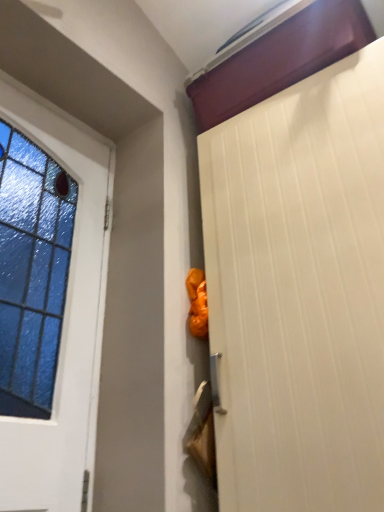
The width and height of the screenshot is (384, 512). What do you see at coordinates (299, 292) in the screenshot? I see `white textured door at upper right, the 2th door positioned from the left` at bounding box center [299, 292].

You are a GUI agent. You are given a task and a screenshot of the screen. Output one action in this format:
    pyautogui.click(x=<x>, y=<y>)
    Task: Click on the white textured door at upper right, the 2th door positioned from the left
    Image resolution: width=384 pixels, height=512 pixels.
    Given the screenshot: What is the action you would take?
    pyautogui.click(x=299, y=292)

What do you see at coordinates (63, 320) in the screenshot? I see `white glass door at left, the first door in the left-to-right sequence` at bounding box center [63, 320].

Image resolution: width=384 pixels, height=512 pixels. Find the location of `white glass door at left, marked as the 2th door in a right-to-left arrangement`. white glass door at left, marked as the 2th door in a right-to-left arrangement is located at coordinates (63, 320).

Where is `white textured door at upper right, the 2th door positioned from the left`? white textured door at upper right, the 2th door positioned from the left is located at coordinates (299, 292).

Which is more to the right, white glass door at left, marked as the 2th door in a right-to-left arrangement, or white textured door at upper right, the 1th door positioned from the right?

From the viewer's perspective, white textured door at upper right, the 1th door positioned from the right, appears more on the right side.

Between white glass door at left, the first door in the left-to-right sequence, and white textured door at upper right, the 1th door positioned from the right, which one is positioned behind?

white glass door at left, the first door in the left-to-right sequence, is behind.

Does point (20, 440) come in front of point (377, 162)?

Yes, it is in front of point (377, 162).

From the image's perspective, between white glass door at left, the first door in the left-to-right sequence, and white textured door at upper right, the 1th door positioned from the right, which one is located above?

From the image's view, white glass door at left, the first door in the left-to-right sequence, is above.

From a real-world perspective, who is located higher, white glass door at left, the first door in the left-to-right sequence, or white textured door at upper right, the 2th door positioned from the left?

In real-world perspective, white glass door at left, the first door in the left-to-right sequence, is above.

Can you confirm if white glass door at left, marked as the 2th door in a right-to-left arrangement, is wider than white textured door at upper right, the 2th door positioned from the left?

In fact, white glass door at left, marked as the 2th door in a right-to-left arrangement, might be narrower than white textured door at upper right, the 2th door positioned from the left.

Who is shorter, white glass door at left, marked as the 2th door in a right-to-left arrangement, or white textured door at upper right, the 1th door positioned from the right?

With less height is white glass door at left, marked as the 2th door in a right-to-left arrangement.

Can you confirm if white glass door at left, marked as the 2th door in a right-to-left arrangement, is smaller than white textured door at upper right, the 1th door positioned from the right?

Indeed, white glass door at left, marked as the 2th door in a right-to-left arrangement, has a smaller size compared to white textured door at upper right, the 1th door positioned from the right.

Is white glass door at left, the first door in the left-to-right sequence, inside the boundaries of white textured door at upper right, the 2th door positioned from the left, or outside?

The correct answer is: outside.

Are white glass door at left, the first door in the left-to-right sequence, and white textured door at upper right, the 1th door positioned from the right, far apart?

That's not correct — white glass door at left, the first door in the left-to-right sequence, is a little close to white textured door at upper right, the 1th door positioned from the right.

Looking at this image, could you tell me if white glass door at left, marked as the 2th door in a right-to-left arrangement, is facing white textured door at upper right, the 1th door positioned from the right?

No.

What's the angular difference between white glass door at left, marked as the 2th door in a right-to-left arrangement, and white textured door at upper right, the 1th door positioned from the right,'s facing directions?

They differ by 85.3 degrees in their facing directions.

How distant is white glass door at left, marked as the 2th door in a right-to-left arrangement, from white textured door at upper right, the 1th door positioned from the right?

A distance of 20.55 inches exists between white glass door at left, marked as the 2th door in a right-to-left arrangement, and white textured door at upper right, the 1th door positioned from the right.

Find the location of a particular element. door that is under the white glass door at left, the first door in the left-to-right sequence (from a real-world perspective) is located at coordinates (299, 292).

Is white textured door at upper right, the 1th door positioned from the right, to the left of white glass door at left, marked as the 2th door in a right-to-left arrangement, from the viewer's perspective?

No.

Is the depth of white textured door at upper right, the 2th door positioned from the left, less than that of white glass door at left, the first door in the left-to-right sequence?

Yes, white textured door at upper right, the 2th door positioned from the left, is closer to the camera.

Is point (205, 257) less distant than point (79, 485)?

No, it is behind (79, 485).

From the image's perspective, is white textured door at upper right, the 1th door positioned from the right, positioned above or below white glass door at left, marked as the 2th door in a right-to-left arrangement?

white textured door at upper right, the 1th door positioned from the right, is below white glass door at left, marked as the 2th door in a right-to-left arrangement.

In the scene shown: From a real-world perspective, which object rests below the other?

white textured door at upper right, the 1th door positioned from the right, from a real-world perspective.

Considering the sizes of white textured door at upper right, the 1th door positioned from the right, and white glass door at left, the first door in the left-to-right sequence, in the image, is white textured door at upper right, the 1th door positioned from the right, wider or thinner than white glass door at left, the first door in the left-to-right sequence,?

In the image, white textured door at upper right, the 1th door positioned from the right, appears to be wider than white glass door at left, the first door in the left-to-right sequence.

Between white textured door at upper right, the 2th door positioned from the left, and white glass door at left, the first door in the left-to-right sequence, which one has more height?

white textured door at upper right, the 2th door positioned from the left, is taller.

In the scene shown: Does white textured door at upper right, the 1th door positioned from the right, have a smaller size compared to white glass door at left, marked as the 2th door in a right-to-left arrangement?

Incorrect, white textured door at upper right, the 1th door positioned from the right, is not smaller in size than white glass door at left, marked as the 2th door in a right-to-left arrangement.

Would you say white textured door at upper right, the 1th door positioned from the right, is outside white glass door at left, marked as the 2th door in a right-to-left arrangement?

Yes, white textured door at upper right, the 1th door positioned from the right, is located beyond the bounds of white glass door at left, marked as the 2th door in a right-to-left arrangement.

Based on the photo, does white textured door at upper right, the 2th door positioned from the left, touch white glass door at left, marked as the 2th door in a right-to-left arrangement?

No.

Is white textured door at upper right, the 1th door positioned from the right, oriented away from white glass door at left, the first door in the left-to-right sequence?

white textured door at upper right, the 1th door positioned from the right, does not have its back to white glass door at left, the first door in the left-to-right sequence.

Can you tell me how much white textured door at upper right, the 2th door positioned from the left, and white glass door at left, marked as the 2th door in a right-to-left arrangement, differ in facing direction?

85.3 degrees separate the facing orientations of white textured door at upper right, the 2th door positioned from the left, and white glass door at left, marked as the 2th door in a right-to-left arrangement.

Could you measure the distance between white textured door at upper right, the 1th door positioned from the right, and white glass door at left, marked as the 2th door in a right-to-left arrangement?

white textured door at upper right, the 1th door positioned from the right, is 20.55 inches away from white glass door at left, marked as the 2th door in a right-to-left arrangement.

Locate an element on the screen. The width and height of the screenshot is (384, 512). door beneath the white glass door at left, marked as the 2th door in a right-to-left arrangement (from a real-world perspective) is located at coordinates (299, 292).

This screenshot has width=384, height=512. I want to click on door above the white textured door at upper right, the 2th door positioned from the left (from the image's perspective), so click(x=63, y=320).

Where is `door in front of the white glass door at left, the first door in the left-to-right sequence`? This screenshot has height=512, width=384. door in front of the white glass door at left, the first door in the left-to-right sequence is located at coordinates (299, 292).